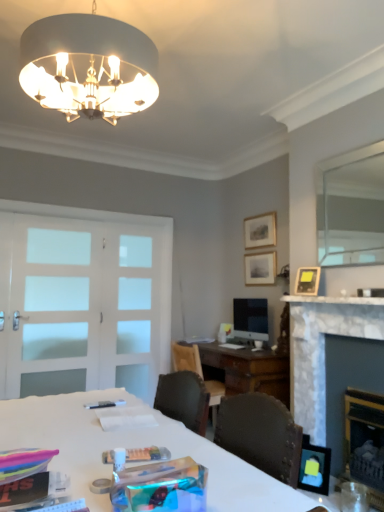
Question: Does satin black monitor at center have a greater height compared to white frosted glass screen door at center, which is the 2th screen door in left-to-right order?

Choices:
 (A) no
 (B) yes

Answer: (A)

Question: Does satin black monitor at center appear on the right side of white frosted glass screen door at center, marked as the first screen door in a right-to-left arrangement?

Choices:
 (A) no
 (B) yes

Answer: (B)

Question: Is white frosted glass screen door at center, which is the 2th screen door in left-to-right order, inside satin black monitor at center?

Choices:
 (A) yes
 (B) no

Answer: (B)

Question: Does satin black monitor at center have a larger size compared to white frosted glass screen door at center, marked as the first screen door in a right-to-left arrangement?

Choices:
 (A) no
 (B) yes

Answer: (A)

Question: Does satin black monitor at center have a lesser height compared to white frosted glass screen door at center, which is the 2th screen door in left-to-right order?

Choices:
 (A) no
 (B) yes

Answer: (B)

Question: In terms of width, does satin black monitor at center look wider or thinner when compared to white frosted glass screen door at center, which is the 2th screen door in left-to-right order?

Choices:
 (A) wide
 (B) thin

Answer: (A)

Question: Considering the relative positions of satin black monitor at center and white frosted glass screen door at center, which is the 2th screen door in left-to-right order, in the image provided, is satin black monitor at center to the left or to the right of white frosted glass screen door at center, which is the 2th screen door in left-to-right order,?

Choices:
 (A) left
 (B) right

Answer: (B)

Question: From the image's perspective, is satin black monitor at center above or below white frosted glass screen door at center, which is the 2th screen door in left-to-right order?

Choices:
 (A) below
 (B) above

Answer: (A)

Question: Is point (241, 315) closer or farther from the camera than point (150, 374)?

Choices:
 (A) closer
 (B) farther

Answer: (A)

Question: Considering their positions, is white frosted glass door at left, marked as the first screen door in a left-to-right arrangement, located in front of or behind satin black monitor at center?

Choices:
 (A) front
 (B) behind

Answer: (A)

Question: From a real-world perspective, relative to satin black monitor at center, is white frosted glass door at left, the second screen door when ordered from right to left, vertically above or below?

Choices:
 (A) below
 (B) above

Answer: (B)

Question: In terms of height, does white frosted glass door at left, the second screen door when ordered from right to left, look taller or shorter compared to satin black monitor at center?

Choices:
 (A) short
 (B) tall

Answer: (B)

Question: Would you say white frosted glass door at left, the second screen door when ordered from right to left, is to the left or to the right of satin black monitor at center in the picture?

Choices:
 (A) right
 (B) left

Answer: (B)

Question: From the image's perspective, is matte black picture frame at lower right, which is counted as the 1th picture frame, starting from the front, positioned above or below marble fireplace at right?

Choices:
 (A) below
 (B) above

Answer: (A)

Question: Is matte black picture frame at lower right, which is the 4th picture frame from top to bottom, wider or thinner than marble fireplace at right?

Choices:
 (A) thin
 (B) wide

Answer: (A)